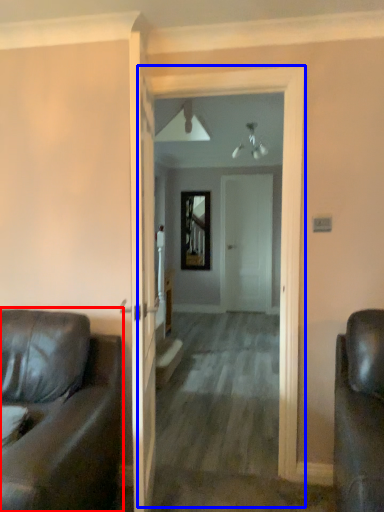
Question: Which object is closer to the camera taking this photo, studio couch (highlighted by a red box) or corridor (highlighted by a blue box)?

Choices:
 (A) studio couch
 (B) corridor

Answer: (A)